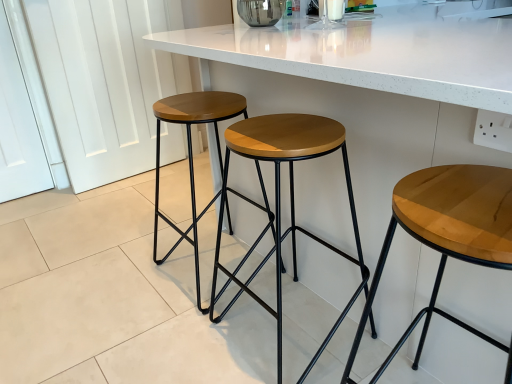
This screenshot has height=384, width=512. Identify the location of wooden/matte stool at center, which is the third stool from right to left. (191, 152).

This screenshot has height=384, width=512. In order to click on white marble countertop at center in this screenshot , I will do `click(370, 89)`.

Identify the location of light brown wood stool at center, positioned as the third stool in left-to-right order. The width and height of the screenshot is (512, 384). (447, 234).

At what (x,y) coordinates should I click in order to perform the action: click on the 2nd stool counting from the left side of the light brown wood stool at center, the first stool positioned from the right. Please return your answer as a coordinate pair (x, y). Image resolution: width=512 pixels, height=384 pixels. Looking at the image, I should click on (191, 152).

Based on the photo, is light brown wood stool at center, the first stool positioned from the right, facing away from wooden/matte stool at center, the first stool when ordered from left to right?

That's not correct — light brown wood stool at center, the first stool positioned from the right, is not looking away from wooden/matte stool at center, the first stool when ordered from left to right.

Does point (452, 183) lie behind point (202, 118)?

No.

Is light brown wood stool at center, positioned as the third stool in left-to-right order, to the right of wooden/matte stool at center, the first stool when ordered from left to right, from the viewer's perspective?

Yes.

Would you consider light brown wood stool at center, the first stool positioned from the right, to be distant from woodenmaterial/texturestool at center, the 2th stool when ordered from left to right?

Actually, light brown wood stool at center, the first stool positioned from the right, and woodenmaterial/texturestool at center, the 2th stool when ordered from left to right, are a little close together.

From the image's perspective, which one is positioned higher, light brown wood stool at center, the first stool positioned from the right, or woodenmaterial/texturestool at center, the 2th stool when ordered from left to right?

woodenmaterial/texturestool at center, the 2th stool when ordered from left to right, from the image's perspective.

From a real-world perspective, which is physically above, light brown wood stool at center, the first stool positioned from the right, or woodenmaterial/texturestool at center, the 2th stool when ordered from left to right?

In real-world perspective, woodenmaterial/texturestool at center, the 2th stool when ordered from left to right, is above.

Is light brown wood stool at center, positioned as the third stool in left-to-right order, positioned with its back to woodenmaterial/texturestool at center, positioned as the second stool in right-to-left order?

No.

Does point (185, 122) come farther from viewer compared to point (275, 244)?

That is False.

Is wooden/matte stool at center, the first stool when ordered from left to right, aimed at woodenmaterial/texturestool at center, positioned as the second stool in right-to-left order?

No.

Is wooden/matte stool at center, the first stool when ordered from left to right, positioned in front of woodenmaterial/texturestool at center, the 2th stool when ordered from left to right?

No, it is not.

Considering the sizes of objects wooden/matte stool at center, which is the third stool from right to left, and woodenmaterial/texturestool at center, the 2th stool when ordered from left to right, in the image provided, who is thinner, wooden/matte stool at center, which is the third stool from right to left, or woodenmaterial/texturestool at center, the 2th stool when ordered from left to right,?

woodenmaterial/texturestool at center, the 2th stool when ordered from left to right.

Is point (302, 158) in front of point (426, 175)?

No, it is not.

Which of these two, woodenmaterial/texturestool at center, positioned as the second stool in right-to-left order, or light brown wood stool at center, positioned as the third stool in left-to-right order, is bigger?

Bigger between the two is woodenmaterial/texturestool at center, positioned as the second stool in right-to-left order.

From a real-world perspective, is woodenmaterial/texturestool at center, the 2th stool when ordered from left to right, located beneath light brown wood stool at center, positioned as the third stool in left-to-right order?

Incorrect, from a real-world perspective, woodenmaterial/texturestool at center, the 2th stool when ordered from left to right, is higher than light brown wood stool at center, positioned as the third stool in left-to-right order.

How far apart are woodenmaterial/texturestool at center, the 2th stool when ordered from left to right, and light brown wood stool at center, the first stool positioned from the right?

woodenmaterial/texturestool at center, the 2th stool when ordered from left to right, and light brown wood stool at center, the first stool positioned from the right, are 25.02 inches apart from each other.

Is woodenmaterial/texturestool at center, the 2th stool when ordered from left to right, positioned beyond the bounds of wooden/matte stool at center, the first stool when ordered from left to right?

Yes, woodenmaterial/texturestool at center, the 2th stool when ordered from left to right, is outside of wooden/matte stool at center, the first stool when ordered from left to right.

Is woodenmaterial/texturestool at center, positioned as the second stool in right-to-left order, touching wooden/matte stool at center, the first stool when ordered from left to right?

No, woodenmaterial/texturestool at center, positioned as the second stool in right-to-left order, is not in contact with wooden/matte stool at center, the first stool when ordered from left to right.

Considering the positions of objects woodenmaterial/texturestool at center, the 2th stool when ordered from left to right, and wooden/matte stool at center, which is the third stool from right to left, in the image provided, who is in front, woodenmaterial/texturestool at center, the 2th stool when ordered from left to right, or wooden/matte stool at center, which is the third stool from right to left,?

woodenmaterial/texturestool at center, the 2th stool when ordered from left to right.

Based on the photo, in terms of size, does woodenmaterial/texturestool at center, positioned as the second stool in right-to-left order, appear bigger or smaller than wooden/matte stool at center, which is the third stool from right to left?

Considering their sizes, woodenmaterial/texturestool at center, positioned as the second stool in right-to-left order, takes up less space than wooden/matte stool at center, which is the third stool from right to left.

From the picture: Which object is closer to the camera, woodenmaterial/texturestool at center, positioned as the second stool in right-to-left order, or white marble countertop at center?

woodenmaterial/texturestool at center, positioned as the second stool in right-to-left order, is more forward.

Is point (289, 153) behind point (398, 15)?

No, it is not.

Can you confirm if woodenmaterial/texturestool at center, positioned as the second stool in right-to-left order, is positioned to the left of white marble countertop at center?

Indeed, woodenmaterial/texturestool at center, positioned as the second stool in right-to-left order, is positioned on the left side of white marble countertop at center.

From the image's perspective, who appears lower, woodenmaterial/texturestool at center, positioned as the second stool in right-to-left order, or white marble countertop at center?

woodenmaterial/texturestool at center, positioned as the second stool in right-to-left order, appears lower in the image.

Would you say light brown wood stool at center, the first stool positioned from the right, contains white marble countertop at center?

No, white marble countertop at center is not inside light brown wood stool at center, the first stool positioned from the right.

Is white marble countertop at center at the back of light brown wood stool at center, the first stool positioned from the right?

No, light brown wood stool at center, the first stool positioned from the right, is not facing away from white marble countertop at center.

Which object is wider, light brown wood stool at center, positioned as the third stool in left-to-right order, or white marble countertop at center?

Wider between the two is white marble countertop at center.

How different are the orientations of light brown wood stool at center, the first stool positioned from the right, and white marble countertop at center in degrees?

89.9 degrees.

At what (x,y) coordinates should I click in order to perform the action: click on stool that is the 2nd object located in front of the wooden/matte stool at center, the first stool when ordered from left to right. Please return your answer as a coordinate pair (x, y). This screenshot has height=384, width=512. Looking at the image, I should click on (447, 234).

In order to click on stool located underneath the woodenmaterial/texturestool at center, the 2th stool when ordered from left to right (from a real-world perspective) in this screenshot , I will do `click(447, 234)`.

From the image, which object appears to be farther from light brown wood stool at center, positioned as the third stool in left-to-right order, wooden/matte stool at center, which is the third stool from right to left, or white marble countertop at center?

wooden/matte stool at center, which is the third stool from right to left, is positioned further to the anchor light brown wood stool at center, positioned as the third stool in left-to-right order.

Estimate the real-world distances between objects in this image. Which object is closer to woodenmaterial/texturestool at center, positioned as the second stool in right-to-left order, white marble countertop at center or wooden/matte stool at center, the first stool when ordered from left to right?

white marble countertop at center is positioned closer to the anchor woodenmaterial/texturestool at center, positioned as the second stool in right-to-left order.

When comparing their distances from white marble countertop at center, does wooden/matte stool at center, the first stool when ordered from left to right, or woodenmaterial/texturestool at center, the 2th stool when ordered from left to right, seem further?

wooden/matte stool at center, the first stool when ordered from left to right.

Estimate the real-world distances between objects in this image. Which object is closer to light brown wood stool at center, the first stool positioned from the right, wooden/matte stool at center, which is the third stool from right to left, or woodenmaterial/texturestool at center, the 2th stool when ordered from left to right?

The object closer to light brown wood stool at center, the first stool positioned from the right, is woodenmaterial/texturestool at center, the 2th stool when ordered from left to right.

From the image, which object appears to be nearer to light brown wood stool at center, the first stool positioned from the right, white marble countertop at center or wooden/matte stool at center, which is the third stool from right to left?

The object closer to light brown wood stool at center, the first stool positioned from the right, is white marble countertop at center.

Looking at the image, which one is located closer to light brown wood stool at center, positioned as the third stool in left-to-right order, woodenmaterial/texturestool at center, the 2th stool when ordered from left to right, or white marble countertop at center?

Based on the image, white marble countertop at center appears to be nearer to light brown wood stool at center, positioned as the third stool in left-to-right order.

Consider the image. When comparing their distances from white marble countertop at center, does wooden/matte stool at center, the first stool when ordered from left to right, or light brown wood stool at center, positioned as the third stool in left-to-right order, seem closer?

wooden/matte stool at center, the first stool when ordered from left to right, is positioned closer to the anchor white marble countertop at center.

From the image, which object appears to be nearer to woodenmaterial/texturestool at center, the 2th stool when ordered from left to right, white marble countertop at center or light brown wood stool at center, positioned as the third stool in left-to-right order?

white marble countertop at center.

The height and width of the screenshot is (384, 512). Identify the location of stool located between light brown wood stool at center, the first stool positioned from the right, and wooden/matte stool at center, which is the third stool from right to left, in the depth direction. (279, 202).